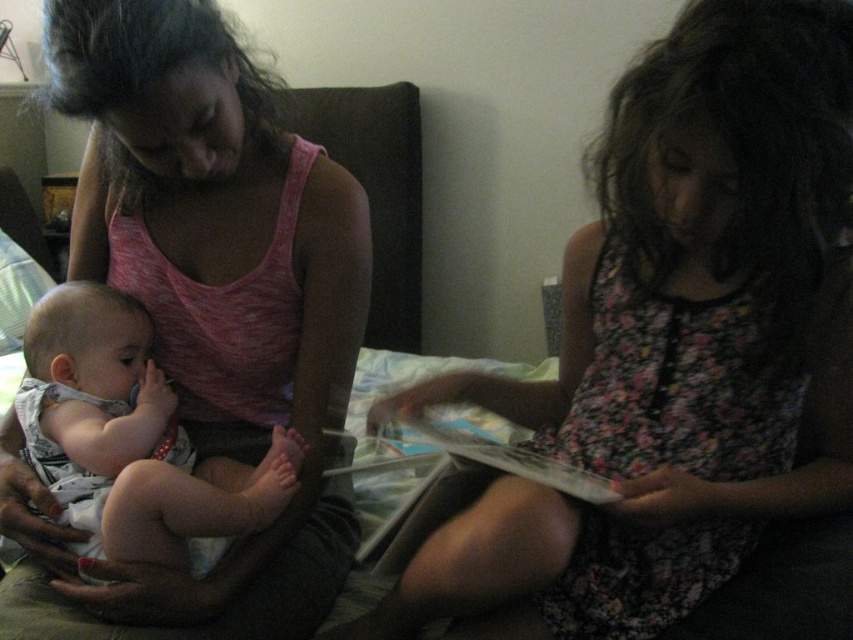
Question: Considering the real-world distances, which object is closest to the white cotton onesie at left?

Choices:
 (A) pink heather tank top at upper left
 (B) floral dress at center

Answer: (A)

Question: Does pink heather tank top at upper left lie behind white cotton onesie at left?

Choices:
 (A) yes
 (B) no

Answer: (B)

Question: Among these points, which one is nearest to the camera?

Choices:
 (A) (329, 422)
 (B) (236, 492)

Answer: (B)

Question: Is pink heather tank top at upper left thinner than white cotton onesie at left?

Choices:
 (A) no
 (B) yes

Answer: (A)

Question: Is floral dress at center further to the viewer compared to white cotton onesie at left?

Choices:
 (A) yes
 (B) no

Answer: (B)

Question: Which point is closer to the camera?

Choices:
 (A) pink heather tank top at upper left
 (B) white cotton onesie at left
 (C) floral dress at center

Answer: (C)